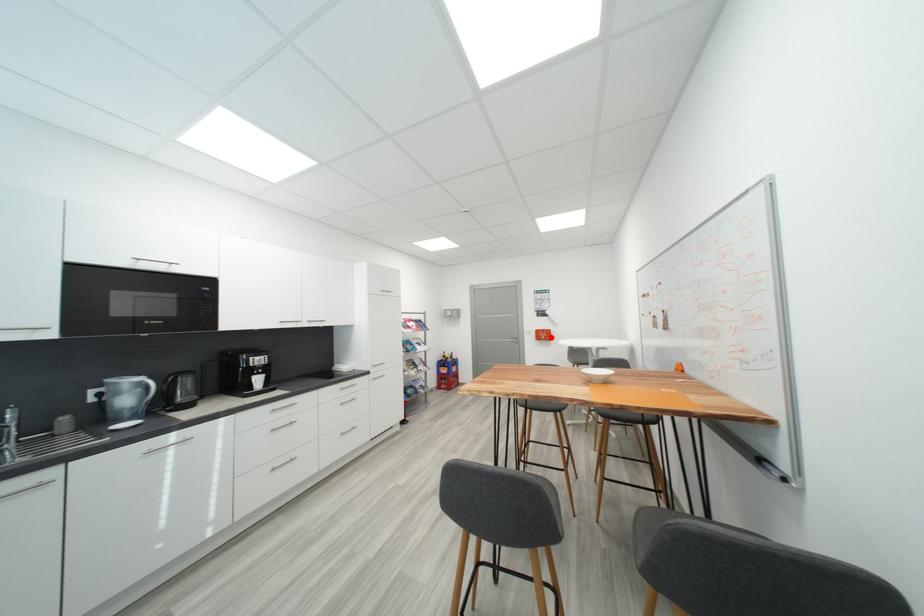
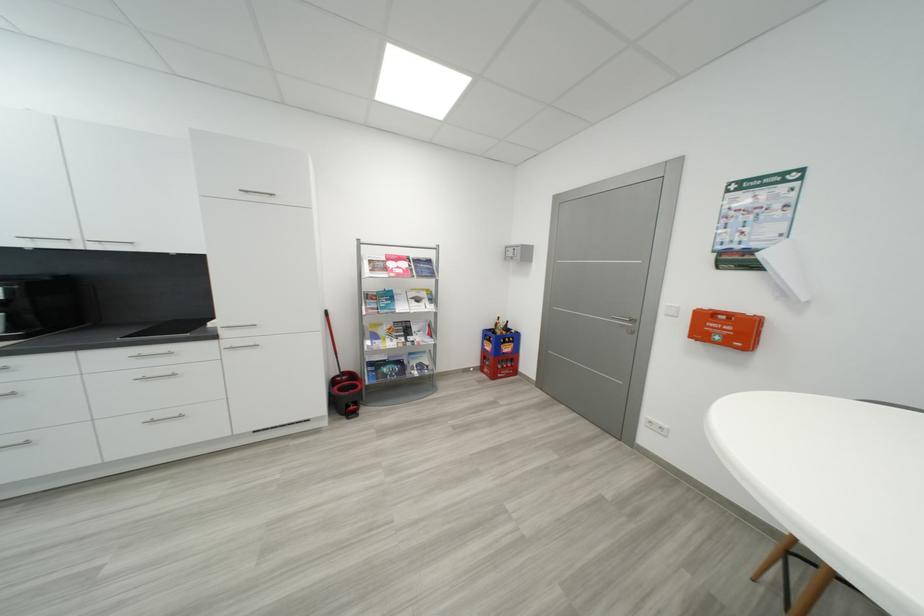
Question: A red point is marked in image1. In image2, is the corresponding 3D point closer to the camera or farther? Reply with the corresponding letter.

Choices:
 (A) The corresponding 3D point is closer.
 (B) The corresponding 3D point is farther.

Answer: (A)